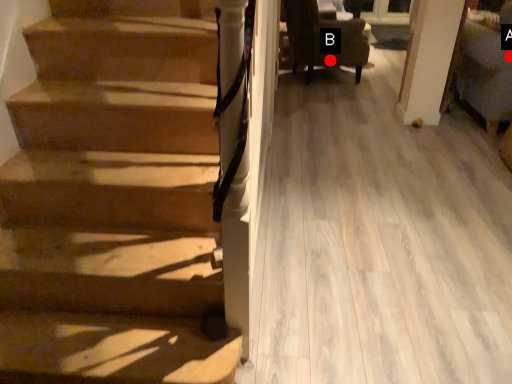
Question: Two points are circled on the image, labeled by A and B beside each circle. Which of the following is the farthest from the observer?

Choices:
 (A) A is further
 (B) B is further

Answer: (B)